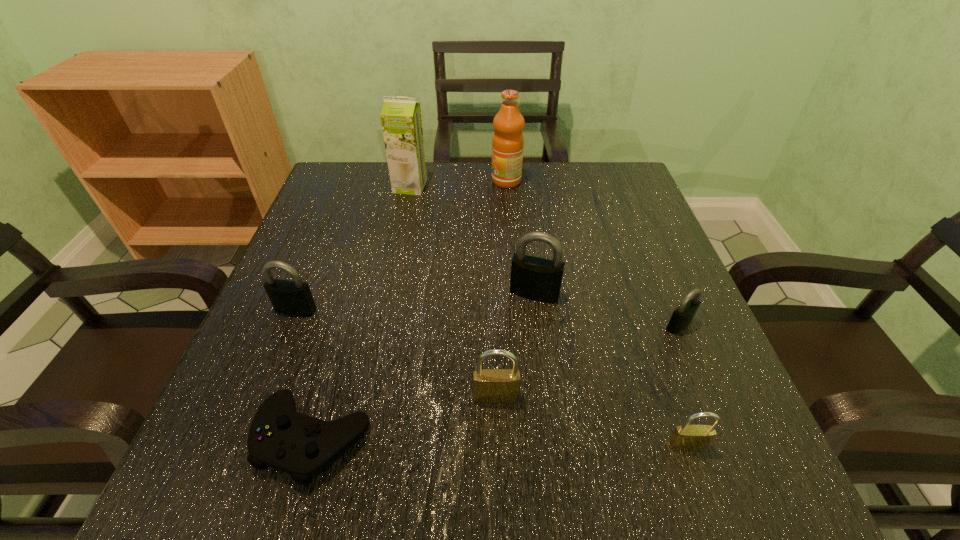
I want to click on the smaller brass padlock, so click(x=685, y=437).

Locate an element on the screen. the second padlock from right to left is located at coordinates (685, 437).

Locate an element on the screen. The width and height of the screenshot is (960, 540). control is located at coordinates 280,437.

This screenshot has width=960, height=540. Identify the location of free space located on the left of the green soya milk. (324, 186).

At what (x,y) coordinates should I click in order to perform the action: click on vacant region located on the label side of the fruit juice. Please return your answer as a coordinate pair (x, y). Image resolution: width=960 pixels, height=540 pixels. Looking at the image, I should click on (342, 181).

You are a GUI agent. You are given a task and a screenshot of the screen. Output one action in this format:
    pyautogui.click(x=<x>, y=<y>)
    Task: Click on the vacant area situated on the label side of the fruit juice
    The width and height of the screenshot is (960, 540).
    Given the screenshot: What is the action you would take?
    pyautogui.click(x=338, y=181)

Locate an element on the screen. Image resolution: width=960 pixels, height=540 pixels. free space located 0.080m on the label side of the fruit juice is located at coordinates (461, 181).

Locate an element on the screen. The image size is (960, 540). vacant position located 0.210m on the front of the tallest padlock is located at coordinates (548, 401).

Where is `blank space located on the right of the second biggest black padlock`? This screenshot has height=540, width=960. blank space located on the right of the second biggest black padlock is located at coordinates (348, 309).

This screenshot has width=960, height=540. I want to click on vacant space located 0.110m on the front-facing side of the second nearest padlock, so click(x=498, y=474).